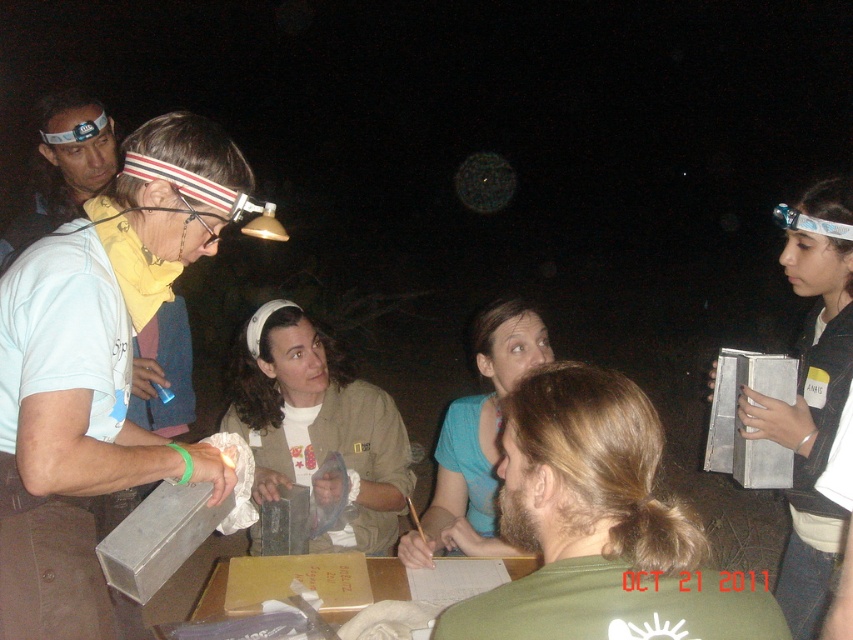
You are standing in front of the group and want to hand a document to both the khaki fabric jacket at center and the matte white shirt at upper left. Which person should you approach first to ensure you can reach them without moving past the other?

You should approach the khaki fabric jacket at center first because it is closer to you than the matte white shirt at upper left, which is further away.